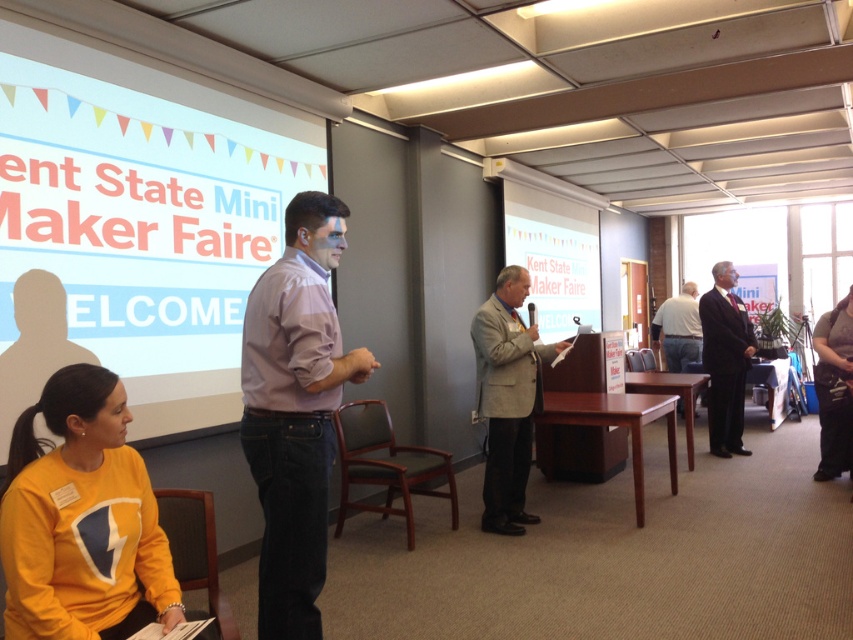
Question: Estimate the real-world distances between objects in this image. Which object is closer to the black fabric purse at lower right?

Choices:
 (A) yellow cotton sweatshirt at lower left
 (B) striped cotton shirt at center
 (C) white matte projection screen at upper left
 (D) light gray suit at center

Answer: (D)

Question: Which object is the closest to the striped cotton shirt at center?

Choices:
 (A) white cotton shirt at center
 (B) light gray suit at center
 (C) white matte projection screen at center

Answer: (B)

Question: Does striped cotton shirt at center have a lesser width compared to white cotton shirt at center?

Choices:
 (A) yes
 (B) no

Answer: (A)

Question: Observing the image, what is the correct spatial positioning of black fabric purse at lower right in reference to white cotton shirt at center?

Choices:
 (A) left
 (B) right

Answer: (B)

Question: Which object is closer to the camera taking this photo?

Choices:
 (A) white cotton shirt at center
 (B) white matte projection screen at upper left
 (C) black fabric purse at lower right
 (D) light gray suit at center

Answer: (B)

Question: Can you confirm if yellow cotton sweatshirt at lower left is positioned above dark gray suit at right?

Choices:
 (A) no
 (B) yes

Answer: (A)